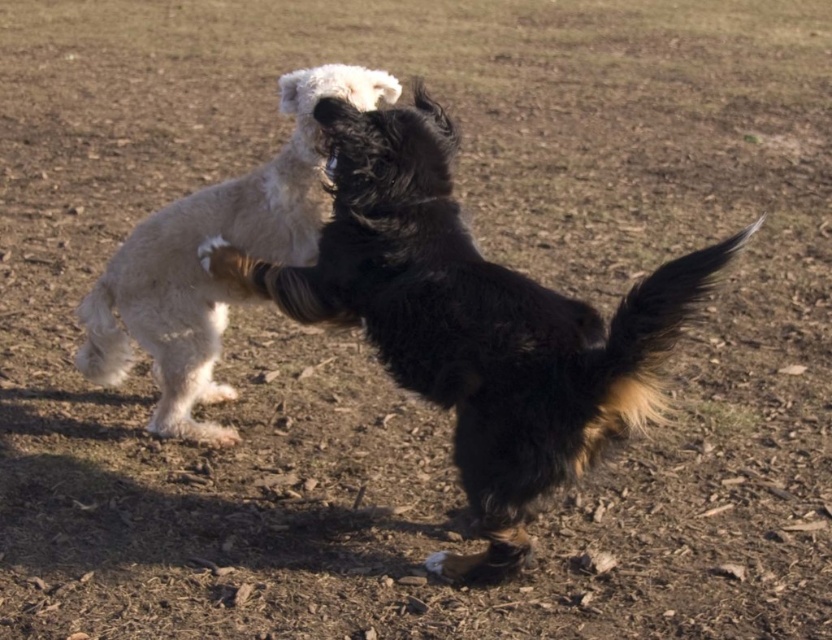
Is fluffy black dog at center further to camera compared to white fluffy dog at center?

No, fluffy black dog at center is in front of white fluffy dog at center.

Between point (419, 392) and point (182, 330), which one is positioned in front?

Point (419, 392)

At what (x,y) coordinates should I click in order to perform the action: click on fluffy black dog at center. Please return your answer as a coordinate pair (x, y). This screenshot has width=832, height=640. Looking at the image, I should click on (473, 321).